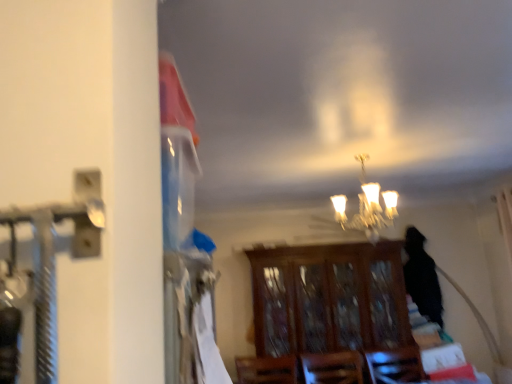
Question: Could you tell me if matte glass chandelier at center is turned towards wooden cabinet at center?

Choices:
 (A) yes
 (B) no

Answer: (B)

Question: Is matte glass chandelier at center far from wooden cabinet at center?

Choices:
 (A) yes
 (B) no

Answer: (A)

Question: Is matte glass chandelier at center closer to camera compared to wooden cabinet at center?

Choices:
 (A) yes
 (B) no

Answer: (A)

Question: Is matte glass chandelier at center looking in the opposite direction of wooden cabinet at center?

Choices:
 (A) yes
 (B) no

Answer: (B)

Question: From a real-world perspective, is matte glass chandelier at center located beneath wooden cabinet at center?

Choices:
 (A) no
 (B) yes

Answer: (A)

Question: Is matte glass chandelier at center further to camera compared to wooden cabinet at center?

Choices:
 (A) no
 (B) yes

Answer: (A)

Question: From the image's perspective, does wooden cabinet at center appear lower than matte glass chandelier at center?

Choices:
 (A) no
 (B) yes

Answer: (B)

Question: Considering the relative sizes of wooden cabinet at center and matte glass chandelier at center in the image provided, is wooden cabinet at center smaller than matte glass chandelier at center?

Choices:
 (A) yes
 (B) no

Answer: (B)

Question: From a real-world perspective, is wooden cabinet at center on top of matte glass chandelier at center?

Choices:
 (A) yes
 (B) no

Answer: (B)

Question: Can you confirm if wooden cabinet at center is bigger than matte glass chandelier at center?

Choices:
 (A) no
 (B) yes

Answer: (B)

Question: Can you confirm if wooden cabinet at center is positioned to the right of matte glass chandelier at center?

Choices:
 (A) yes
 (B) no

Answer: (A)

Question: Can you confirm if wooden cabinet at center is thinner than matte glass chandelier at center?

Choices:
 (A) yes
 (B) no

Answer: (B)

Question: Based on their positions, is wooden cabinet at center located to the left or right of matte glass chandelier at center?

Choices:
 (A) right
 (B) left

Answer: (A)